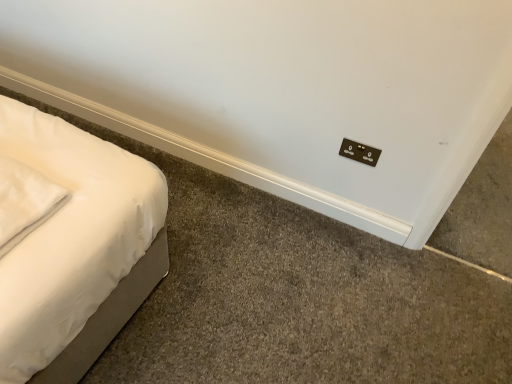
Question: From the image's perspective, is brown matte electric outlet at upper right positioned above or below white soft pillow at left?

Choices:
 (A) below
 (B) above

Answer: (B)

Question: Is brown matte electric outlet at upper right wider or thinner than white soft pillow at left?

Choices:
 (A) thin
 (B) wide

Answer: (A)

Question: Visually, is brown matte electric outlet at upper right positioned to the left or to the right of white soft pillow at left?

Choices:
 (A) right
 (B) left

Answer: (A)

Question: From a real-world perspective, is white soft pillow at left physically located above or below brown matte electric outlet at upper right?

Choices:
 (A) below
 (B) above

Answer: (B)

Question: Is white soft pillow at left to the left or to the right of brown matte electric outlet at upper right in the image?

Choices:
 (A) right
 (B) left

Answer: (B)

Question: Is white soft pillow at left in front of or behind brown matte electric outlet at upper right in the image?

Choices:
 (A) front
 (B) behind

Answer: (A)

Question: Looking at their shapes, would you say white soft pillow at left is wider or thinner than brown matte electric outlet at upper right?

Choices:
 (A) wide
 (B) thin

Answer: (A)